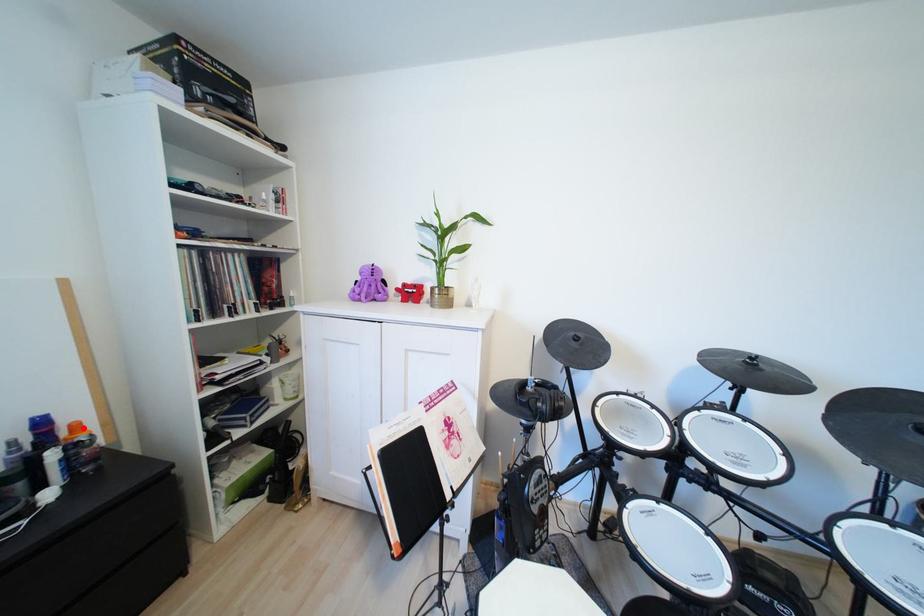
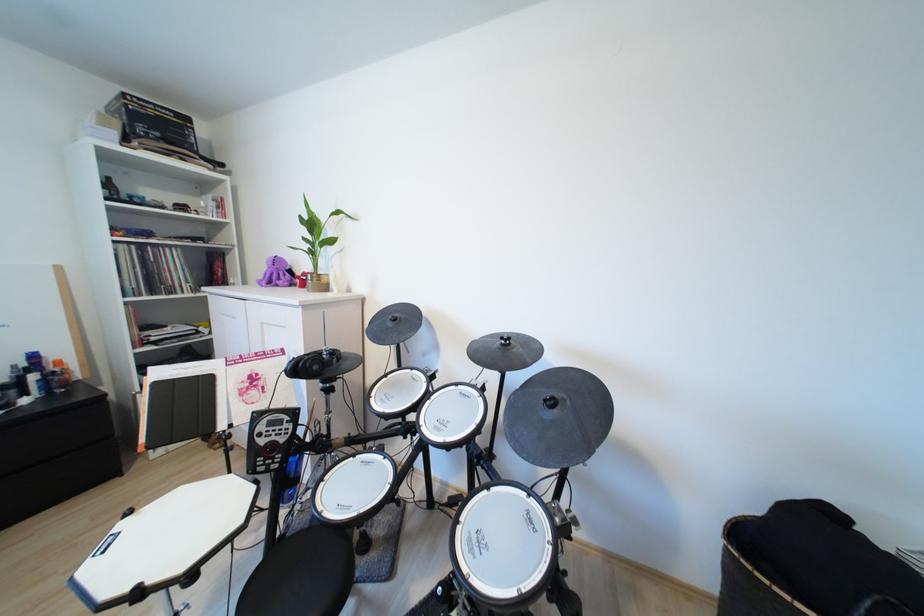
Question: I am providing you with two images of the same scene from different viewpoints. Image1 has a red point marked. In image2, the corresponding 3D location appears at what relative position? Reply with the corresponding letter.

Choices:
 (A) Closer
 (B) Farther

Answer: (B)